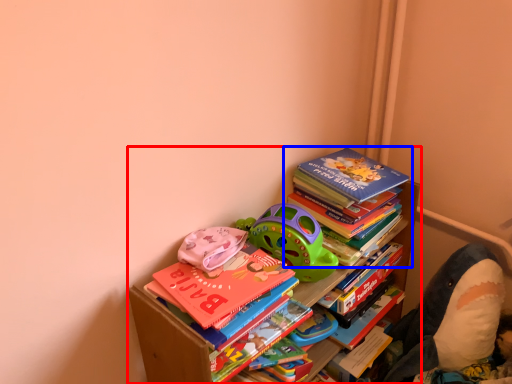
Question: Which point is further to the camera, bookcase (highlighted by a red box) or book (highlighted by a blue box)?

Choices:
 (A) bookcase
 (B) book

Answer: (B)